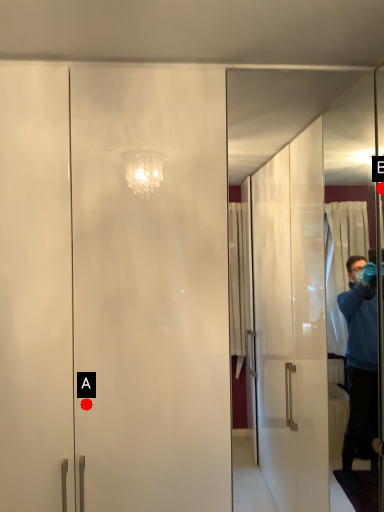
Question: Two points are circled on the image, labeled by A and B beside each circle. Which point is farther to the camera?

Choices:
 (A) A is further
 (B) B is further

Answer: (B)